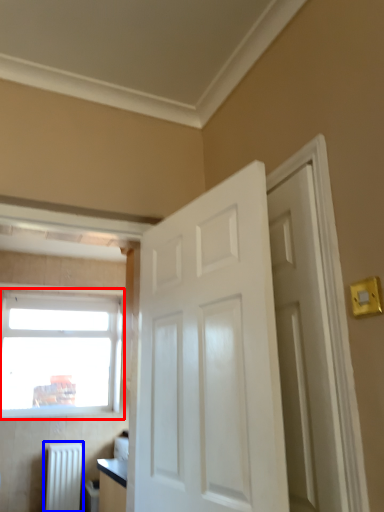
Question: Which of the following is the closest to the observer, window (highlighted by a red box) or radiator (highlighted by a blue box)?

Choices:
 (A) window
 (B) radiator

Answer: (B)